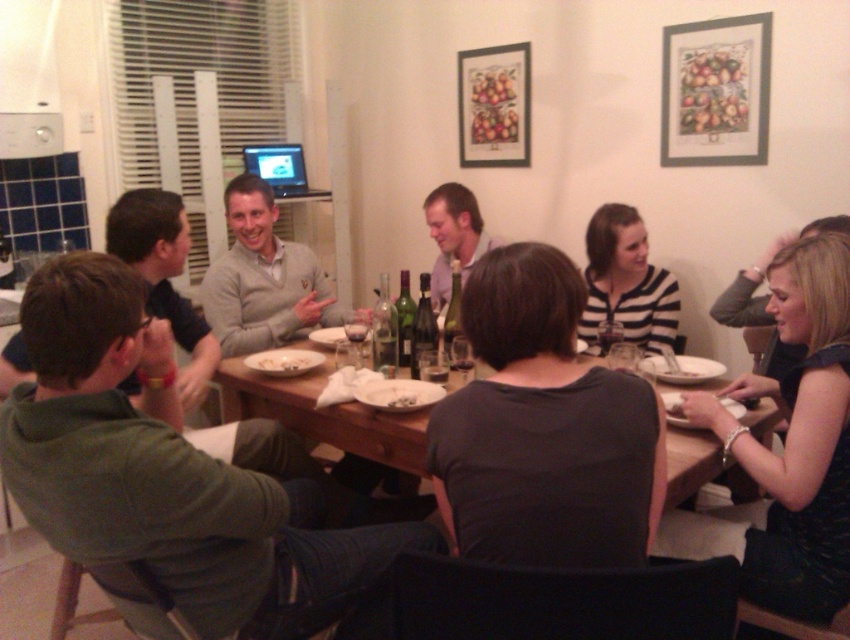
The height and width of the screenshot is (640, 850). In order to click on green matte shirt at left in this screenshot , I will do `click(163, 276)`.

Between green matte shirt at left and striped cotton shirt at center, which one is positioned lower?

Positioned lower is green matte shirt at left.

Identify the location of green matte shirt at left. The height and width of the screenshot is (640, 850). point(163,276).

Can you confirm if green cotton shirt at left is positioned to the left of black dress at lower right?

Correct, you'll find green cotton shirt at left to the left of black dress at lower right.

Can you confirm if green cotton shirt at left is thinner than black dress at lower right?

In fact, green cotton shirt at left might be wider than black dress at lower right.

Does point (44, 500) come closer to viewer compared to point (834, 342)?

Yes, it is in front of point (834, 342).

Image resolution: width=850 pixels, height=640 pixels. Find the location of `green cotton shirt at left`. green cotton shirt at left is located at coordinates (173, 468).

Does green matte shirt at left have a larger size compared to white matte plate at center?

Correct, green matte shirt at left is larger in size than white matte plate at center.

Does green matte shirt at left appear under white matte plate at center?

Incorrect, green matte shirt at left is not positioned below white matte plate at center.

Who is more distant from viewer, (x=123, y=228) or (x=310, y=369)?

Point (x=310, y=369)

The width and height of the screenshot is (850, 640). I want to click on green matte shirt at left, so click(163, 276).